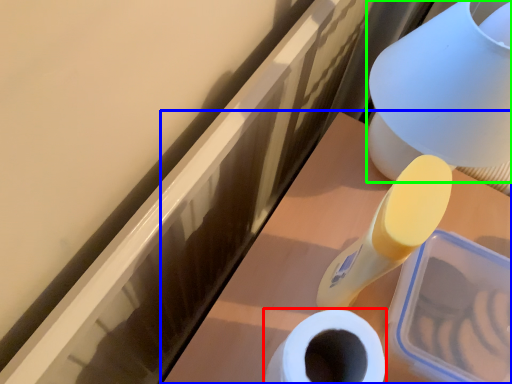
Question: Based on their relative distances, which object is farther from toilet paper (highlighted by a red box)? Choose from vanity (highlighted by a blue box) and table lamp (highlighted by a green box).

Choices:
 (A) vanity
 (B) table lamp

Answer: (B)